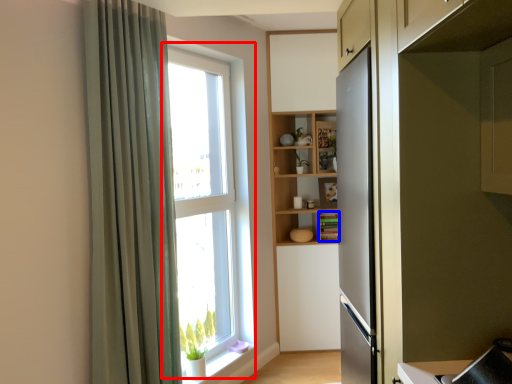
Question: Which of the following is the farthest to the observer, window (highlighted by a red box) or cabinet (highlighted by a blue box)?

Choices:
 (A) window
 (B) cabinet

Answer: (B)